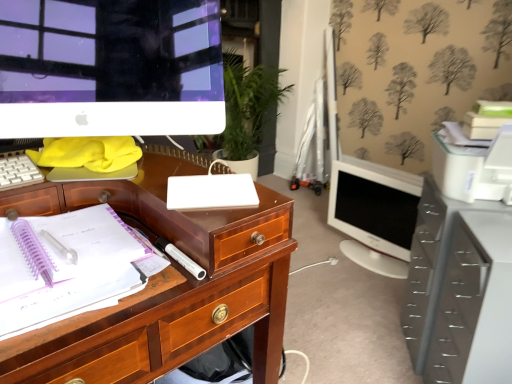
Identify the location of blank space above translucent plastic pen at left, which ranks as the 2th office supplies in top-to-bottom order (from a real-world perspective). This screenshot has height=384, width=512. (58, 242).